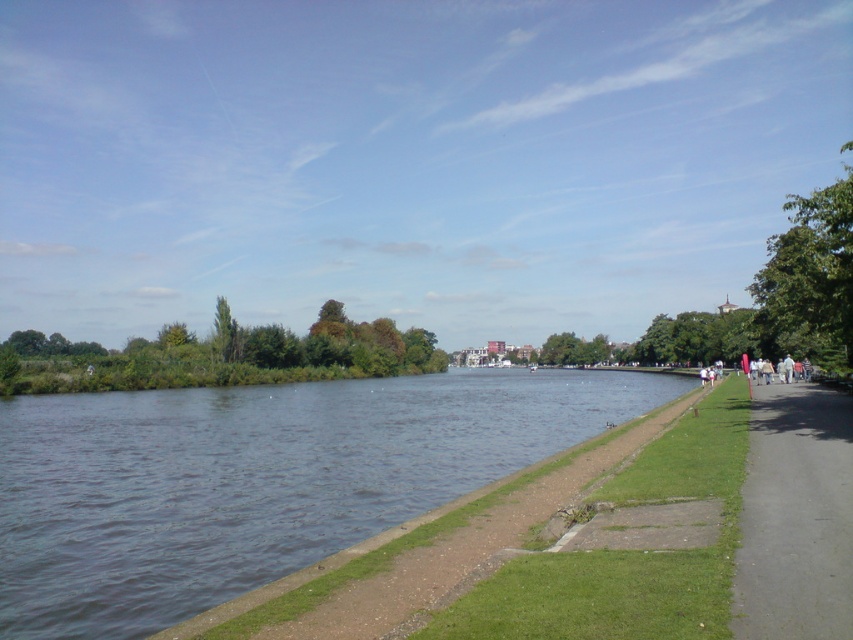
You are a hiker trying to cross the river using the black asphalt path at right and the green leafy trees at center as landmarks. Which landmark is closer to the riverbank?

The black asphalt path at right is shorter than green leafy trees at center, so the black asphalt path at right is closer to the riverbank.

You are a photographer planning to capture the entire riverside scene. You notice the dark blue water at center and the green leafy tree at upper left in your viewfinder. Based on their sizes, which one should you zoom out to include more of?

The dark blue water at center is narrower than the green leafy tree at upper left, so you should zoom out to include more of the dark blue water at center.